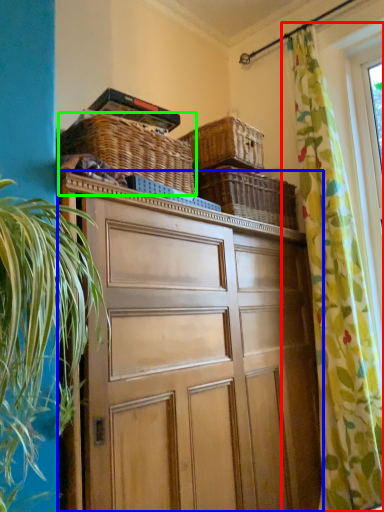
Question: Which object is the closest to the curtain (highlighted by a red box)? Choose among these: cabinetry (highlighted by a blue box) or basket (highlighted by a green box).

Choices:
 (A) cabinetry
 (B) basket

Answer: (A)